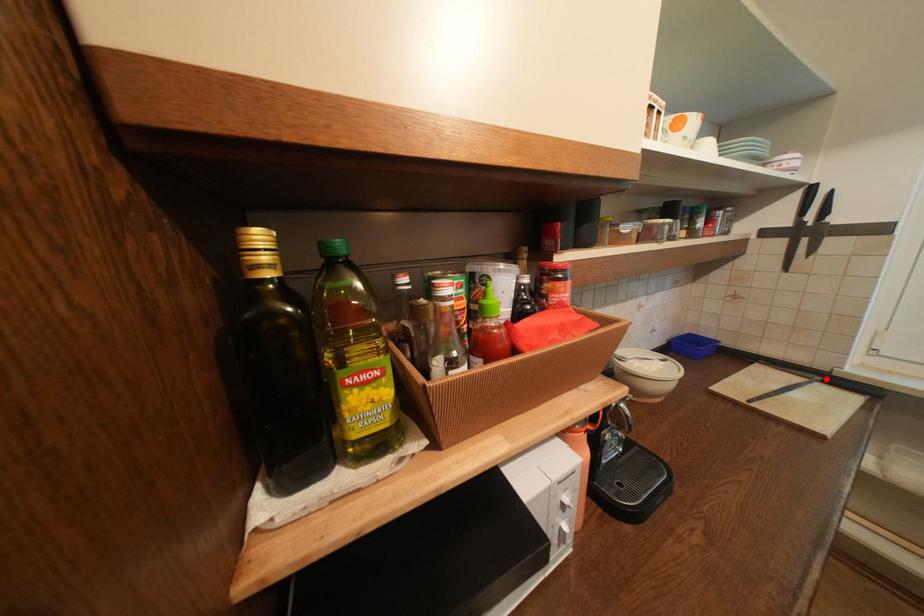
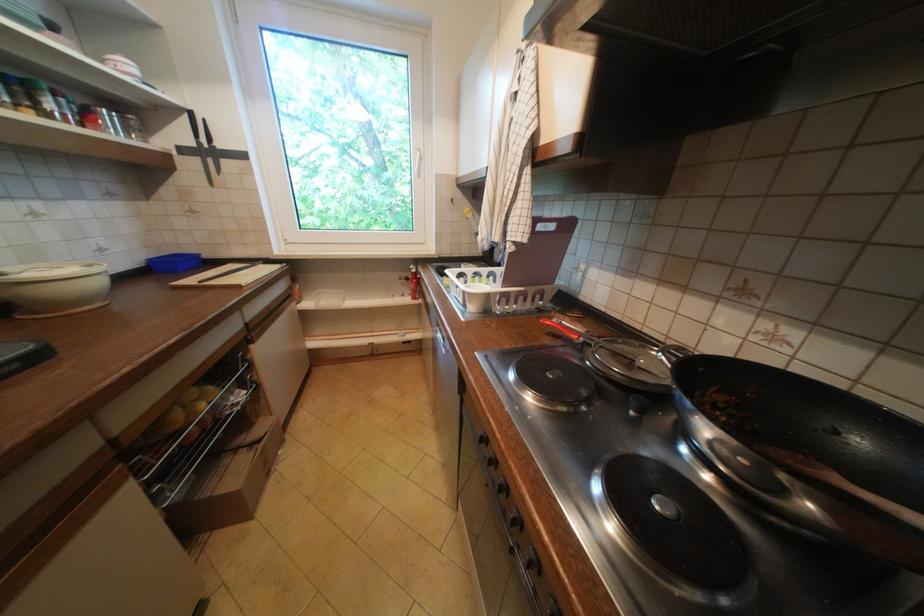
Locate, in the second image, the point that corresponds to the highlighted location in the first image.

(270, 262)